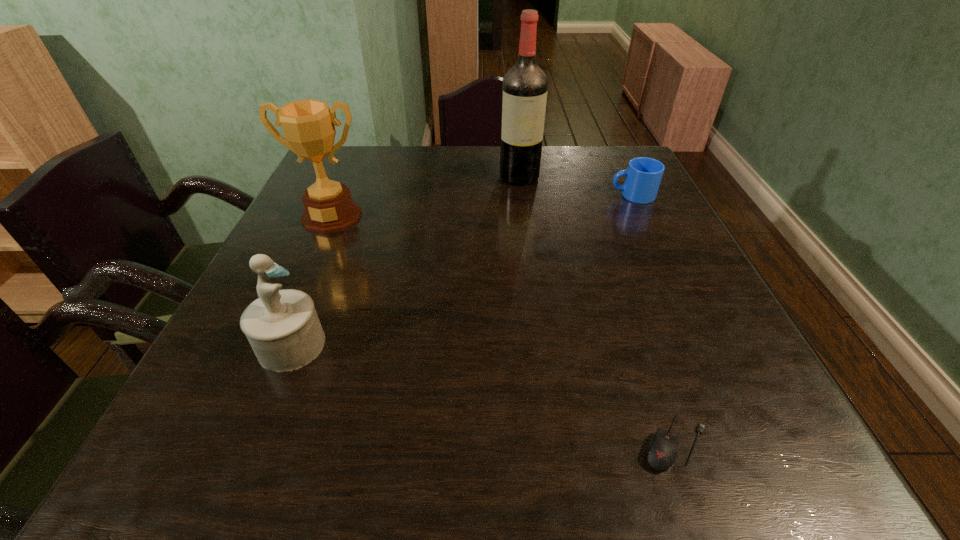
Where is `mug located in the right edge section of the desktop`? This screenshot has width=960, height=540. mug located in the right edge section of the desktop is located at coordinates (643, 177).

I want to click on mouse that is positioned at the right edge, so (662, 453).

Locate an element on the screen. object located at the near right corner is located at coordinates (662, 453).

I want to click on blank space at the far edge, so click(402, 177).

Locate an element on the screen. vacant region at the near edge of the desktop is located at coordinates (481, 478).

You are a GUI agent. You are given a task and a screenshot of the screen. Output one action in this format:
    pyautogui.click(x=<x>, y=<y>)
    Task: Click on the vacant space at the left edge
    The image size is (960, 540).
    Given the screenshot: What is the action you would take?
    pyautogui.click(x=273, y=416)

This screenshot has height=540, width=960. In the image, there is a desktop. Identify the location of vacant space at the right edge. (750, 375).

Find the location of a particular element. This screenshot has height=540, width=960. free space at the far right corner is located at coordinates point(620,178).

In the image, there is a desktop. Where is `vacant space at the near right corner`? vacant space at the near right corner is located at coordinates (809, 465).

Locate an element on the screen. vacant area that lies between the mug and the third object from left to right is located at coordinates (576, 186).